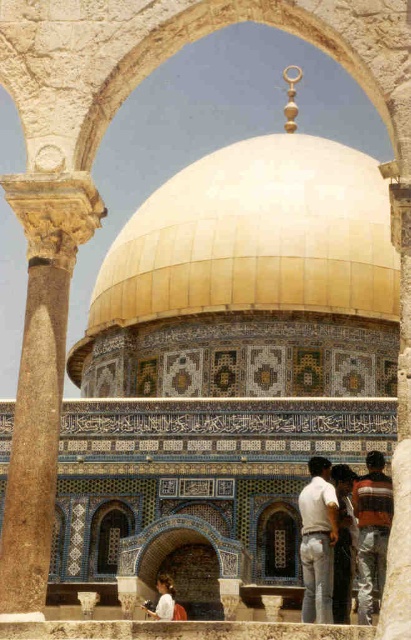
Question: Does brown stone column at left appear on the right side of white cotton shirt at lower center?

Choices:
 (A) yes
 (B) no

Answer: (B)

Question: Which point is farther to the camera?

Choices:
 (A) striped cotton shirt at center
 (B) white cotton shirt at center
 (C) brown stone column at left

Answer: (A)

Question: In this image, where is brown stone column at left located relative to white cotton shirt at center?

Choices:
 (A) right
 (B) left

Answer: (B)

Question: Which of the following is the farthest from the observer?

Choices:
 (A) [x=378, y=568]
 (B) [x=307, y=502]
 (C) [x=323, y=390]
 (D) [x=147, y=612]

Answer: (C)

Question: Can you confirm if gold mosaic dome at center is thinner than brown stone column at left?

Choices:
 (A) no
 (B) yes

Answer: (A)

Question: Which object is the farthest from the gold mosaic dome at center?

Choices:
 (A) striped cotton shirt at center
 (B) white cotton shirt at lower center

Answer: (B)